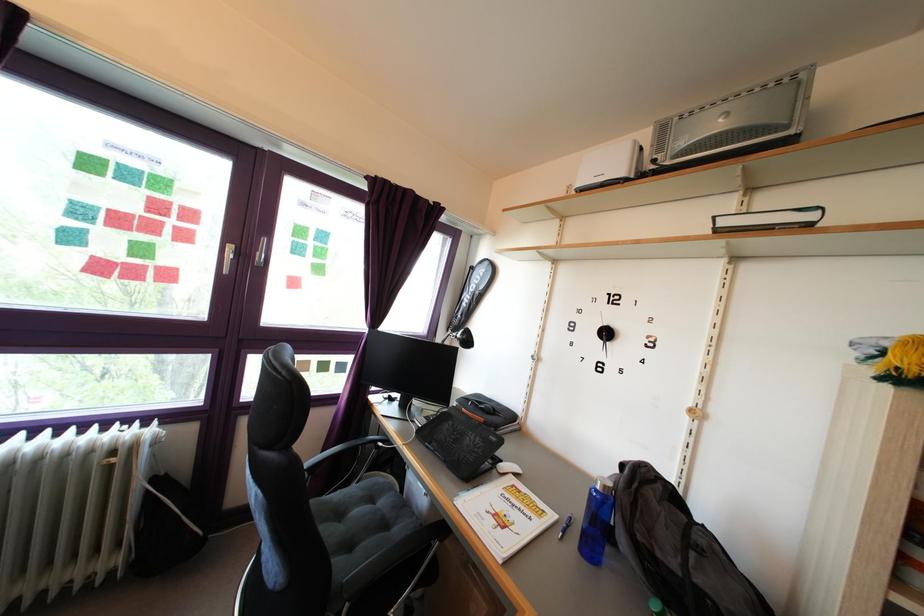
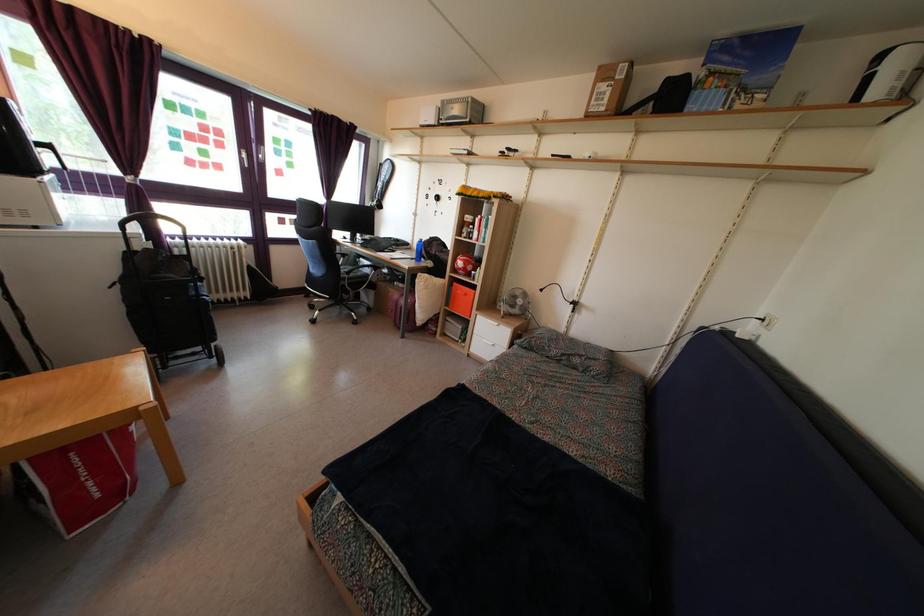
The point at (529, 419) is marked in the first image. Where is the corresponding point in the second image?

(416, 249)